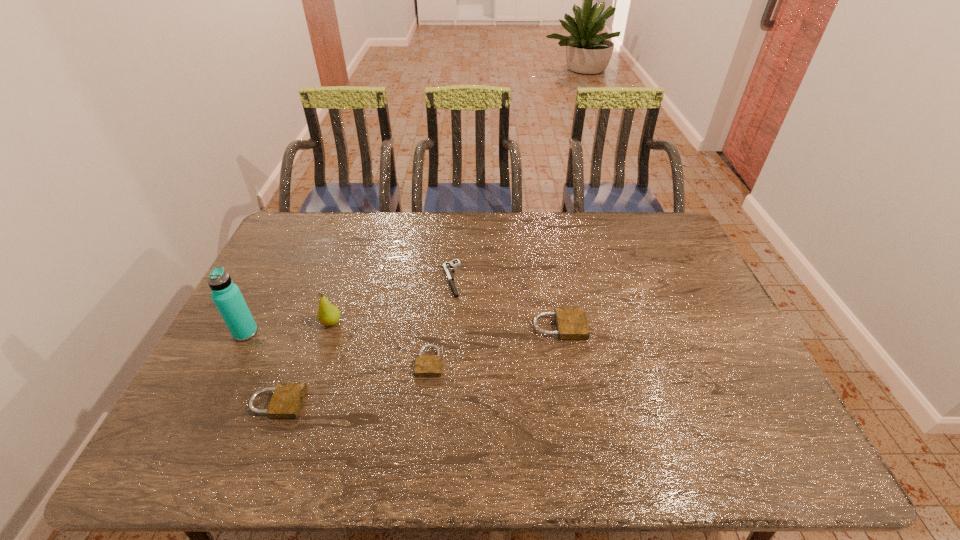
Where is `the nearest object`? the nearest object is located at coordinates (287, 399).

The width and height of the screenshot is (960, 540). In order to click on the third shortest object in this screenshot , I will do `click(287, 399)`.

Where is `the shortest padlock`? the shortest padlock is located at coordinates (425, 366).

Where is `the second padlock from left to right`? The height and width of the screenshot is (540, 960). the second padlock from left to right is located at coordinates (425, 366).

What are the coordinates of `the farthest padlock` in the screenshot? It's located at (571, 322).

Identify the location of the rightmost padlock. (571, 322).

What are the coordinates of `pear` in the screenshot? It's located at (328, 314).

The image size is (960, 540). Find the location of `the shortest object`. the shortest object is located at coordinates (448, 266).

Locate an element on the screen. pistol is located at coordinates (448, 266).

This screenshot has width=960, height=540. Find the location of `water bottle`. water bottle is located at coordinates (227, 297).